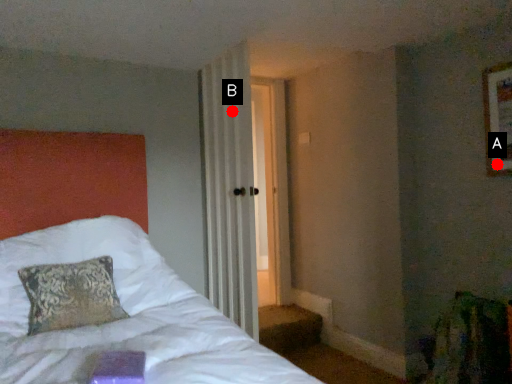
Question: Two points are circled on the image, labeled by A and B beside each circle. Which point is closer to the camera?

Choices:
 (A) A is closer
 (B) B is closer

Answer: (A)